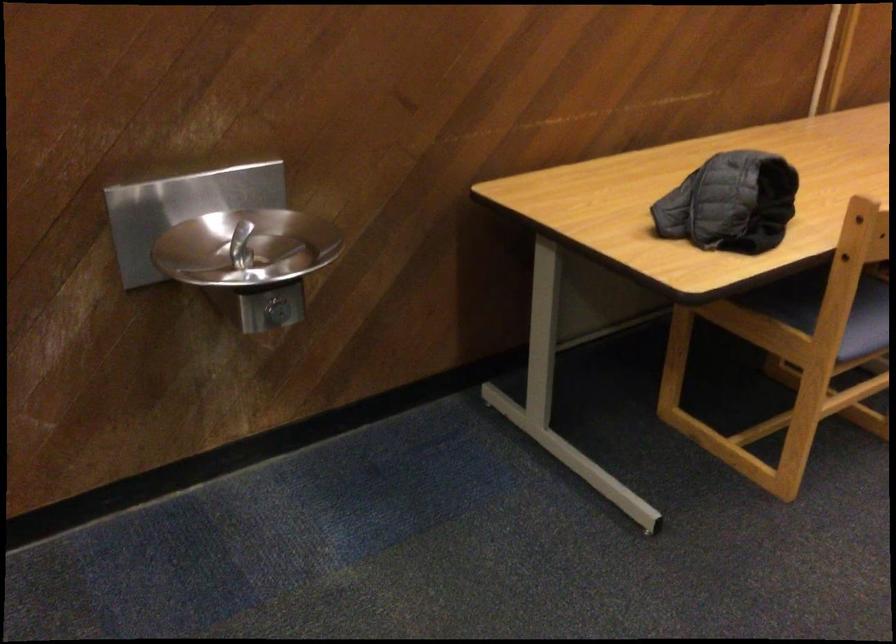
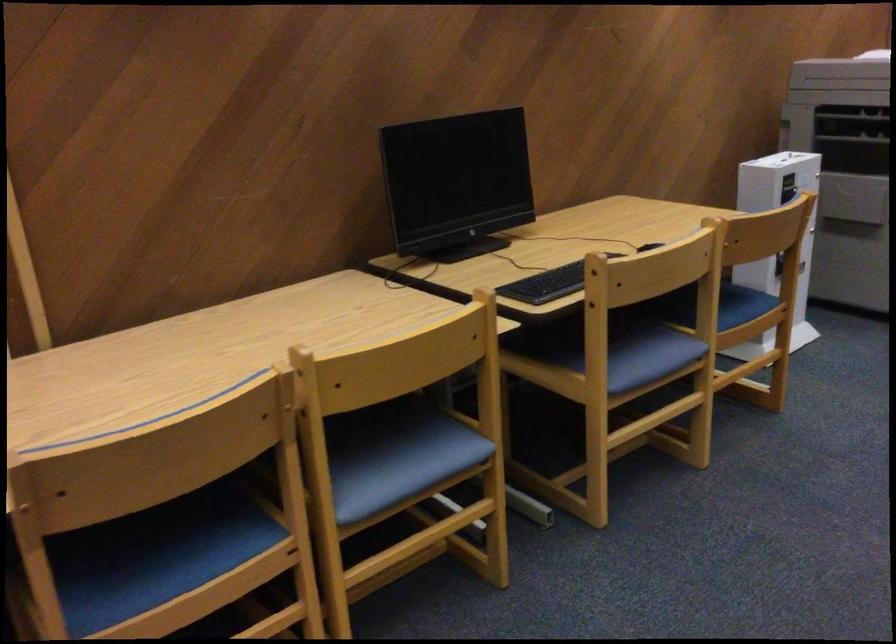
Question: Which direction would the cameraman need to move to produce the second image? Reply with the corresponding letter.

Choices:
 (A) Left
 (B) Right
 (C) Forward
 (D) Backward

Answer: (B)